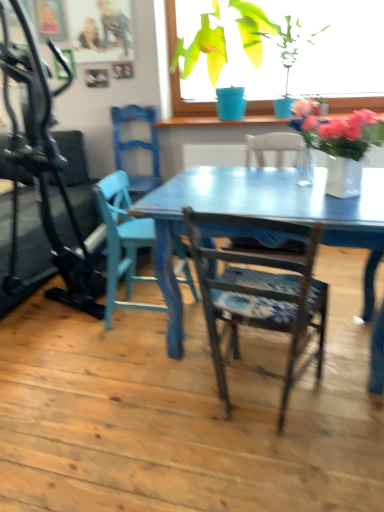
Question: Is green glossy plant at upper center, arranged as the 2th houseplant when viewed from the left, taller than green matte plant pot at upper center, the second houseplant viewed from the right?

Choices:
 (A) no
 (B) yes

Answer: (A)

Question: Considering the relative sizes of green glossy plant at upper center, arranged as the 2th houseplant when viewed from the left, and green matte plant pot at upper center, the 1th houseplant from the left, in the image provided, is green glossy plant at upper center, arranged as the 2th houseplant when viewed from the left, smaller than green matte plant pot at upper center, the 1th houseplant from the left,?

Choices:
 (A) yes
 (B) no

Answer: (A)

Question: From the image's perspective, is green glossy plant at upper center, arranged as the 2th houseplant when viewed from the left, located above green matte plant pot at upper center, the 1th houseplant from the left?

Choices:
 (A) yes
 (B) no

Answer: (B)

Question: From a real-world perspective, is green glossy plant at upper center, which is counted as the first houseplant, starting from the right, under green matte plant pot at upper center, the 1th houseplant from the left?

Choices:
 (A) yes
 (B) no

Answer: (A)

Question: Considering the relative sizes of green glossy plant at upper center, which is counted as the first houseplant, starting from the right, and green matte plant pot at upper center, the second houseplant viewed from the right, in the image provided, is green glossy plant at upper center, which is counted as the first houseplant, starting from the right, bigger than green matte plant pot at upper center, the second houseplant viewed from the right,?

Choices:
 (A) yes
 (B) no

Answer: (B)

Question: Is point (246, 3) closer or farther from the camera than point (215, 332)?

Choices:
 (A) farther
 (B) closer

Answer: (A)

Question: Based on their sizes in the image, would you say green matte plant pot at upper center, the 1th houseplant from the left, is bigger or smaller than blue painted wood chair at center, which is the 3th chair in back-to-front order?

Choices:
 (A) small
 (B) big

Answer: (B)

Question: Would you say green matte plant pot at upper center, the 1th houseplant from the left, is to the left or to the right of blue painted wood chair at center, which is the 3th chair in back-to-front order, in the picture?

Choices:
 (A) left
 (B) right

Answer: (A)

Question: From the image's perspective, relative to blue painted wood chair at center, which is the 3th chair in back-to-front order, is green matte plant pot at upper center, the second houseplant viewed from the right, above or below?

Choices:
 (A) above
 (B) below

Answer: (A)

Question: Considering the positions of point (147, 141) and point (125, 196), is point (147, 141) closer or farther from the camera than point (125, 196)?

Choices:
 (A) farther
 (B) closer

Answer: (A)

Question: In terms of size, does matte blue chair at left, the first chair viewed from the back, appear bigger or smaller than matte blue chair at center, the second chair from the front?

Choices:
 (A) small
 (B) big

Answer: (B)

Question: In the image, is matte blue chair at left, the first chair viewed from the back, positioned in front of or behind matte blue chair at center, the second chair from the back?

Choices:
 (A) front
 (B) behind

Answer: (B)

Question: Is matte blue chair at left, the 3th chair viewed from the front, taller or shorter than matte blue chair at center, the second chair from the front?

Choices:
 (A) tall
 (B) short

Answer: (B)

Question: In the image, is matte blue chair at left, the first chair viewed from the back, on the left side or the right side of green matte plant pot at upper center, the 1th houseplant from the left?

Choices:
 (A) left
 (B) right

Answer: (A)

Question: From a real-world perspective, relative to green matte plant pot at upper center, the second houseplant viewed from the right, is matte blue chair at left, the 3th chair viewed from the front, vertically above or below?

Choices:
 (A) above
 (B) below

Answer: (B)